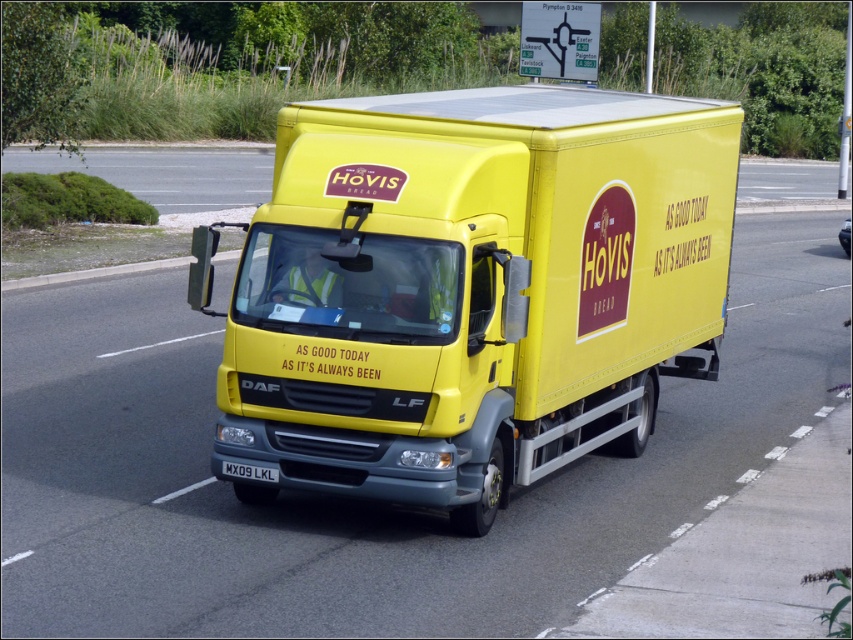
You are a delivery driver who needs to park your yellow matte truck at center under a low bridge. The bridge has a height restriction sign that says the maximum allowed height is equal to the height of the black plastic license plate at center. Can your truck pass under the bridge without hitting it?

The yellow matte truck at center is taller than the black plastic license plate at center. Therefore, the truck cannot pass under the bridge without hitting it because its height exceeds the maximum allowed limit indicated by the license plate.

You are a pedestrian standing on the sidewalk watching the yellow matte truck at center and the black plastic license plate at center drive by. Which object will appear closer to you as they pass by?

The yellow matte truck at center will appear closer to you because it is positioned further to the viewer than the black plastic license plate at center, meaning it is nearer in your line of sight.